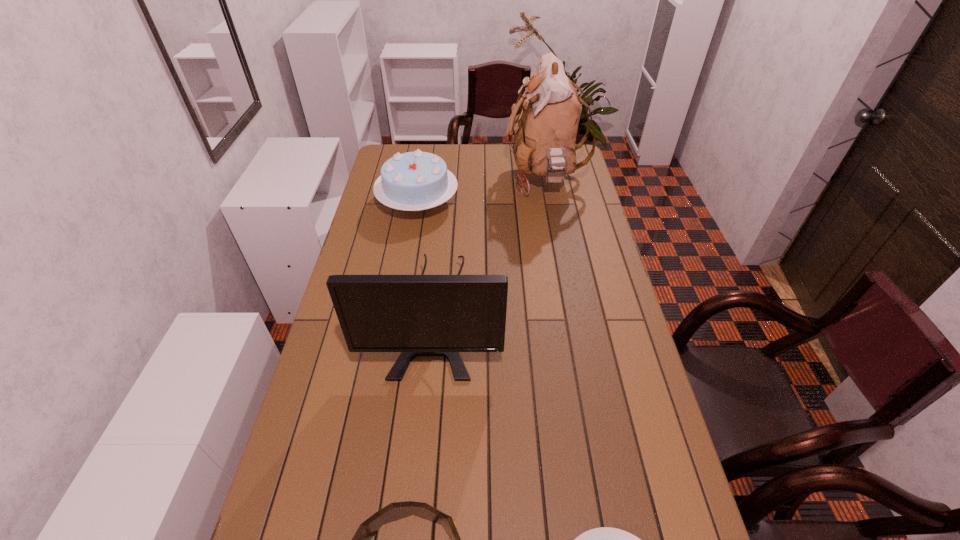
Locate an element on the screen. The height and width of the screenshot is (540, 960). blank region between the third tallest object and the tallest object is located at coordinates (481, 191).

I want to click on free space that is in between the computer monitor and the tallest object, so click(490, 246).

At what (x,y) coordinates should I click in order to perform the action: click on the second closest object relative to the shortest object. Please return your answer as a coordinate pair (x, y). The image size is (960, 540). Looking at the image, I should click on (418, 315).

At what (x,y) coordinates should I click in order to perform the action: click on the closest object relative to the steak. Please return your answer as a coordinate pair (x, y). Looking at the image, I should click on (395, 511).